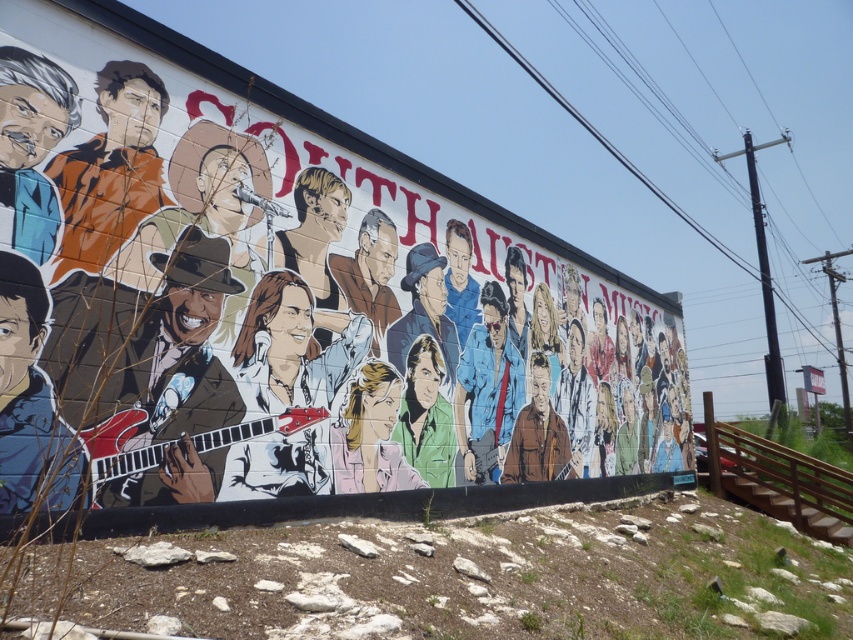
Can you confirm if pastel pink fabric at center is positioned to the right of smooth skin portrait at center?

Correct, you'll find pastel pink fabric at center to the right of smooth skin portrait at center.

Can you confirm if pastel pink fabric at center is positioned to the left of smooth skin portrait at center?

Incorrect, pastel pink fabric at center is not on the left side of smooth skin portrait at center.

Does point (389, 371) come farther from viewer compared to point (381, 291)?

No.

This screenshot has height=640, width=853. Identify the location of pastel pink fabric at center. (370, 435).

Who is positioned more to the left, orange fabric shirt at upper left or matte brown jacket at left?

matte brown jacket at left

Who is positioned more to the right, orange fabric shirt at upper left or matte brown jacket at left?

orange fabric shirt at upper left is more to the right.

Is point (134, 97) behind point (28, 502)?

That is True.

I want to click on orange fabric shirt at upper left, so click(111, 168).

Which is behind, point (460, 401) or point (553, 477)?

Point (553, 477)

Who is positioned more to the right, blue denim jacket at center or brown leather jacket at center?

brown leather jacket at center is more to the right.

Does point (488, 468) come closer to viewer compared to point (506, 477)?

That is True.

You are a GUI agent. You are given a task and a screenshot of the screen. Output one action in this format:
    pyautogui.click(x=<x>, y=<y>)
    Task: Click on the blue denim jacket at center
    
    Given the screenshot: What is the action you would take?
    pyautogui.click(x=486, y=388)